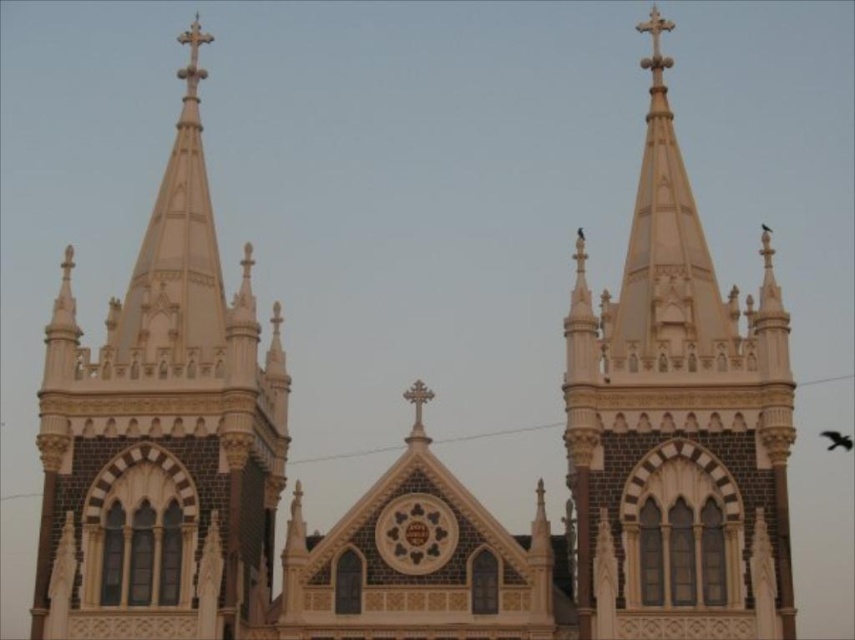
You are an architect planning to install a new lighting system on the white stone spire at center and the white stone steeple at upper center. The lighting cables can only reach up to 25 meters between two points. Will the cables be sufficient to connect both structures?

The distance between the white stone spire at center and the white stone steeple at upper center is 23.74 meters, which is within the 25 meters limit of the cables. Therefore, the cables will be sufficient to connect both structures.

You are an architect designing a miniature model of this building. You need to ensure the white stone spire at center and the white stone steeple at upper center are proportionally accurate. Which one should you make wider in your model?

You should make the white stone spire at center wider than the white stone steeple at upper center because its width is larger according to the description.

You are standing in front of the grand Gothic building. A tour guide points to a specific point on the building and asks you to identify which part of the building it corresponds to. The coordinates of the point are given as point (162, 433). Based on the description, which architectural feature does this point most likely belong to?

The point (162, 433) corresponds to the white stone spire at center.